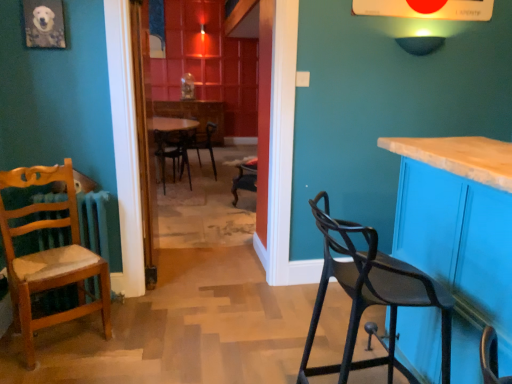
Question: From the image's perspective, would you say wooden chair with cushion at left, the 1th chair positioned from the left, is positioned over wooden table at center?

Choices:
 (A) no
 (B) yes

Answer: (A)

Question: Considering the relative sizes of wooden chair with cushion at left, the third chair from the back, and wooden table at center in the image provided, is wooden chair with cushion at left, the third chair from the back, wider than wooden table at center?

Choices:
 (A) yes
 (B) no

Answer: (A)

Question: From a real-world perspective, is wooden chair with cushion at left, the 1th chair positioned from the left, beneath wooden table at center?

Choices:
 (A) yes
 (B) no

Answer: (A)

Question: Is wooden chair with cushion at left, positioned as the second chair in front-to-back order, to the left of wooden table at center from the viewer's perspective?

Choices:
 (A) yes
 (B) no

Answer: (B)

Question: Can you confirm if wooden chair with cushion at left, positioned as the second chair in front-to-back order, is shorter than wooden table at center?

Choices:
 (A) no
 (B) yes

Answer: (B)

Question: From a real-world perspective, is wooden chair with cushion at left, the 1th chair positioned from the left, positioned over wooden table at center based on gravity?

Choices:
 (A) no
 (B) yes

Answer: (A)

Question: Is matte wood cabinet at right wider than wooden table at center?

Choices:
 (A) no
 (B) yes

Answer: (B)

Question: Is matte wood cabinet at right next to wooden table at center and touching it?

Choices:
 (A) yes
 (B) no

Answer: (B)

Question: Considering the relative positions of matte wood cabinet at right and wooden table at center in the image provided, is matte wood cabinet at right to the right of wooden table at center from the viewer's perspective?

Choices:
 (A) yes
 (B) no

Answer: (A)

Question: From a real-world perspective, is matte wood cabinet at right physically below wooden table at center?

Choices:
 (A) yes
 (B) no

Answer: (A)

Question: Could you tell me if matte wood cabinet at right is facing wooden table at center?

Choices:
 (A) yes
 (B) no

Answer: (B)

Question: From the image's perspective, would you say matte wood cabinet at right is shown under wooden table at center?

Choices:
 (A) yes
 (B) no

Answer: (A)

Question: Is black matte chair at center, placed as the 2th chair when sorted from left to right, thinner than black matte bar stool at right, which appears as the fourth chair when viewed from the back?

Choices:
 (A) yes
 (B) no

Answer: (B)